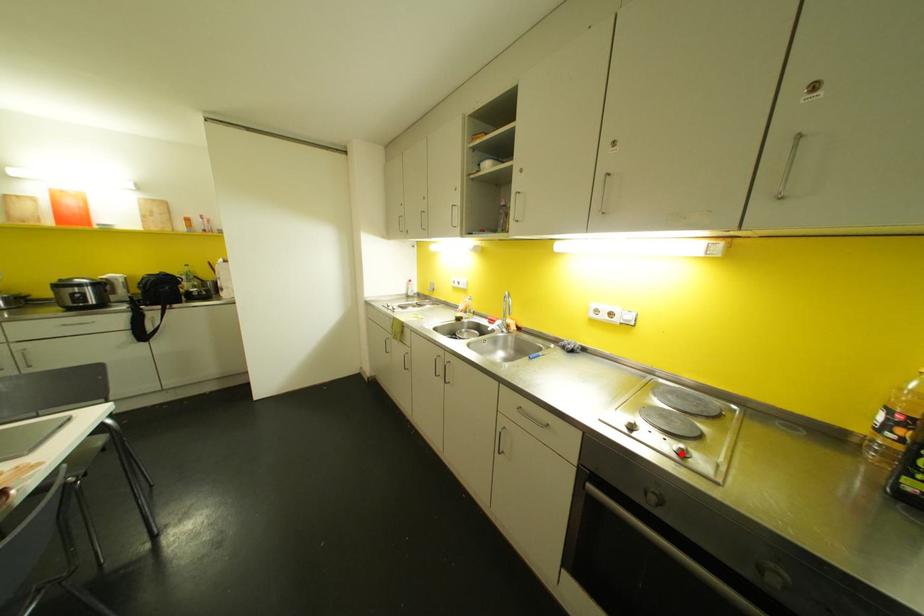
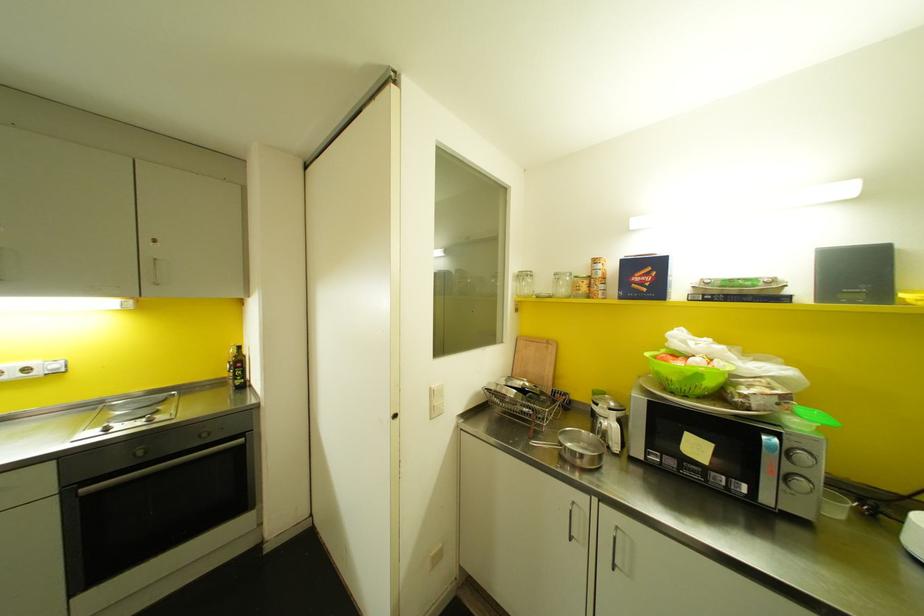
Question: I am providing you with two images of the same scene from different viewpoints. A red point is marked on the first image. At the location where the point appears in image 1, is it still visible in image 2?

Choices:
 (A) Yes
 (B) No

Answer: (A)